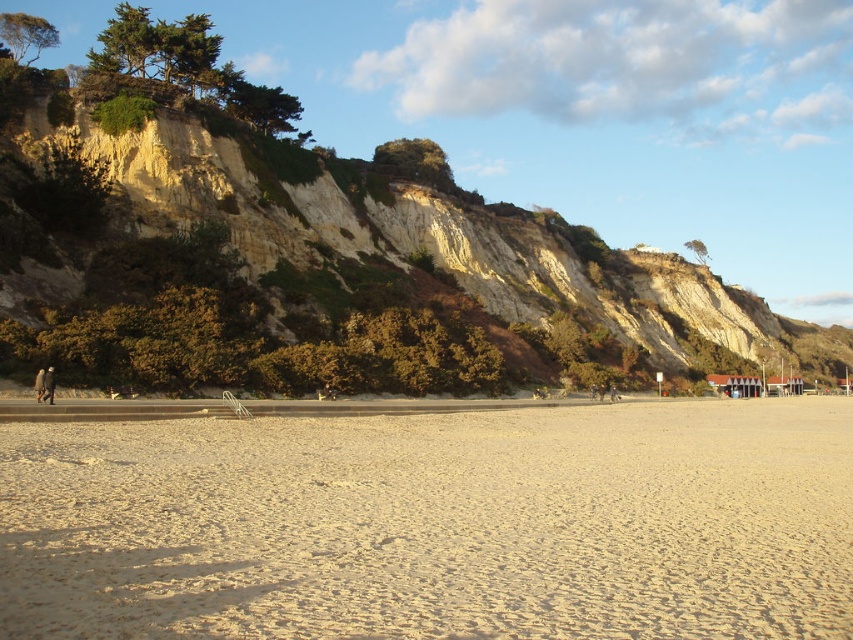
You are a hiker who wants to place your brown wool coat at left on the brown rocky cliff at upper left. Given that you can carry the coat, but can only walk 300 feet, will you be able to reach the cliff from where you are standing?

The brown rocky cliff at upper left and brown wool coat at left are 362.80 feet apart. Since the distance is greater than 300 feet, you cannot reach the cliff with the coat in hand.

You are standing at the point labeled point [434,524]. Looking around, you see the beige sandy beach at lower center. Which direction should you walk to reach the paved pathway in the midground?

The point [434,524] is located on the beige sandy beach at lower center, which is closer to the lower part of the image. The paved pathway is in the midground, so you should walk upwards towards the midground to reach it.

You are standing at the center of the image and want to walk towards the beige sandy beach at lower center. In which direction should you move?

The beige sandy beach at lower center is located at point (x=434, y=524), so you should move downward and to the right to reach it.